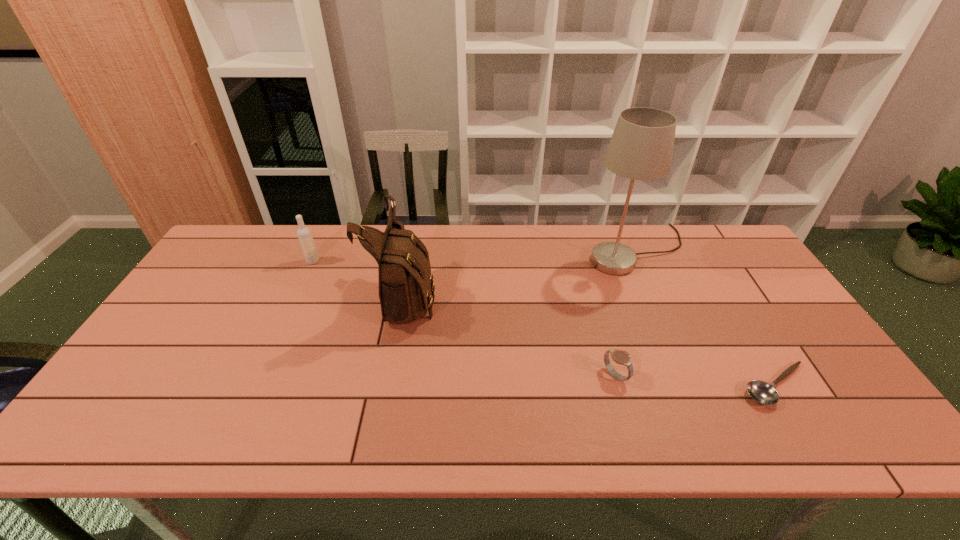
In order to click on object that is the closest to the shortest object in this screenshot , I will do `click(620, 357)`.

In order to click on the third closest object relative to the second shortest object in this screenshot , I will do `click(406, 284)`.

Locate an element on the screen. Image resolution: width=960 pixels, height=540 pixels. free spot that satisfies the following two spatial constraints: 1. on the front-facing side of the shortest object; 2. on the left side of the second object from left to right is located at coordinates (390, 386).

Identify the location of vacant point that satisfies the following two spatial constraints: 1. on the front-facing side of the shoulder bag; 2. on the left side of the watch. The image size is (960, 540). pyautogui.click(x=392, y=375).

Identify the location of free point that satisfies the following two spatial constraints: 1. on the front side of the table lamp; 2. on the front-facing side of the second object from left to right. Image resolution: width=960 pixels, height=540 pixels. (654, 295).

At what (x,y) coordinates should I click in order to perform the action: click on vacant area that satisfies the following two spatial constraints: 1. on the front-facing side of the shoulder bag; 2. on the left side of the shortest object. Please return your answer as a coordinate pair (x, y). The width and height of the screenshot is (960, 540). Looking at the image, I should click on pos(390,386).

Find the location of a particular element. vacant space that satisfies the following two spatial constraints: 1. on the front-facing side of the second object from left to right; 2. on the right side of the shortest object is located at coordinates (390, 386).

This screenshot has height=540, width=960. In order to click on blank area in the image that satisfies the following two spatial constraints: 1. on the front side of the watch; 2. on the left side of the shortest object in this screenshot , I will do `click(618, 386)`.